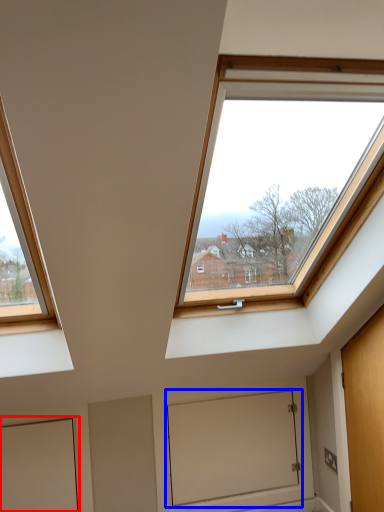
Question: Which of the following is the closest to the observer, door (highlighted by a red box) or window screen (highlighted by a blue box)?

Choices:
 (A) door
 (B) window screen

Answer: (A)